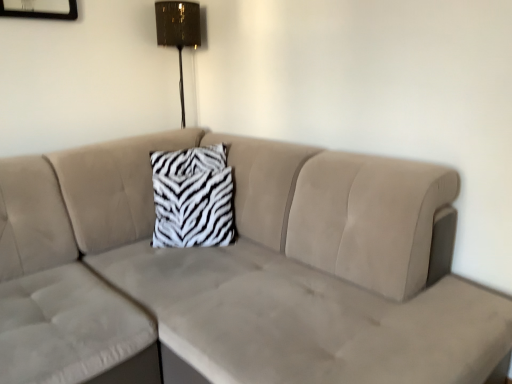
What do you see at coordinates (193, 197) in the screenshot? I see `zebra-patterned fabric pillow at center` at bounding box center [193, 197].

What do you see at coordinates (178, 32) in the screenshot? I see `metallic gold lampshade at upper center` at bounding box center [178, 32].

I want to click on zebra-patterned fabric pillow at center, so click(193, 197).

Would you say zebra-patterned fabric pillow at center is outside beige velvety couch at center?

No.

Is point (200, 170) closer or farther from the camera than point (108, 215)?

Point (200, 170) is farther from the camera than point (108, 215).

Considering the sizes of zebra-patterned fabric pillow at center and beige velvety couch at center in the image, is zebra-patterned fabric pillow at center wider or thinner than beige velvety couch at center?

zebra-patterned fabric pillow at center is thinner than beige velvety couch at center.

How many degrees apart are the facing directions of zebra-patterned fabric pillow at center and beige velvety couch at center?

49.5 degrees.

Between point (466, 376) and point (170, 222), which one is positioned in front?

The point (466, 376) is closer.

Which object is thinner, beige velvety couch at center or zebra-patterned fabric pillow at center?

zebra-patterned fabric pillow at center.

Who is taller, beige velvety couch at center or zebra-patterned fabric pillow at center?

Standing taller between the two is beige velvety couch at center.

Considering the relative sizes of beige velvety couch at center and zebra-patterned fabric pillow at center in the image provided, is beige velvety couch at center smaller than zebra-patterned fabric pillow at center?

No.

Which is more to the right, zebra-patterned fabric pillow at center or metallic gold lampshade at upper center?

From the viewer's perspective, zebra-patterned fabric pillow at center appears more on the right side.

Between point (225, 203) and point (157, 21), which one is positioned behind?

The point (157, 21) is farther.

Is zebra-patterned fabric pillow at center not close to metallic gold lampshade at upper center?

zebra-patterned fabric pillow at center is actually quite close to metallic gold lampshade at upper center.

In order to click on lamp above the zebra-patterned fabric pillow at center (from the image's perspective) in this screenshot , I will do `click(178, 32)`.

Find the location of a particular element. The height and width of the screenshot is (384, 512). lamp on the left of zebra-patterned fabric pillow at center is located at coordinates (178, 32).

From the picture: Between metallic gold lampshade at upper center and zebra-patterned fabric pillow at center, which one has less height?

Standing shorter between the two is zebra-patterned fabric pillow at center.

Is metallic gold lampshade at upper center completely or partially outside of zebra-patterned fabric pillow at center?

Indeed, metallic gold lampshade at upper center is completely outside zebra-patterned fabric pillow at center.

Between point (159, 40) and point (217, 202), which one is positioned in front?

The point (217, 202) is closer to the camera.

How different are the orientations of beige velvety couch at center and metallic gold lampshade at upper center in degrees?

90.2 degrees.

Considering the points (14, 376) and (165, 30), which point is in front, point (14, 376) or point (165, 30)?

The point (14, 376) is closer to the camera.

Would you say beige velvety couch at center is inside or outside metallic gold lampshade at upper center?

beige velvety couch at center is located beyond the bounds of metallic gold lampshade at upper center.

From the image's perspective, which one is positioned higher, beige velvety couch at center or metallic gold lampshade at upper center?

metallic gold lampshade at upper center, from the image's perspective.

Considering the positions of objects metallic gold lampshade at upper center and beige velvety couch at center in the image provided, who is behind, metallic gold lampshade at upper center or beige velvety couch at center?

metallic gold lampshade at upper center is further from the camera.

Who is shorter, metallic gold lampshade at upper center or beige velvety couch at center?

metallic gold lampshade at upper center.

Considering the positions of objects metallic gold lampshade at upper center and beige velvety couch at center in the image provided, who is more to the right, metallic gold lampshade at upper center or beige velvety couch at center?

From the viewer's perspective, beige velvety couch at center appears more on the right side.

Could you tell me if metallic gold lampshade at upper center is facing beige velvety couch at center?

No, metallic gold lampshade at upper center does not turn towards beige velvety couch at center.

Locate an element on the screen. Image resolution: width=512 pixels, height=384 pixels. pillow on the left of beige velvety couch at center is located at coordinates (193, 197).

I want to click on studio couch on the right of zebra-patterned fabric pillow at center, so [240, 270].

Considering their positions, is beige velvety couch at center positioned further to zebra-patterned fabric pillow at center than metallic gold lampshade at upper center?

metallic gold lampshade at upper center lies further to zebra-patterned fabric pillow at center than the other object.

From the picture: Which object lies nearer to the anchor point metallic gold lampshade at upper center, zebra-patterned fabric pillow at center or beige velvety couch at center?

Among the two, zebra-patterned fabric pillow at center is located nearer to metallic gold lampshade at upper center.

Which object lies further to the anchor point beige velvety couch at center, zebra-patterned fabric pillow at center or metallic gold lampshade at upper center?

→ The object further to beige velvety couch at center is metallic gold lampshade at upper center.

Based on their spatial positions, is beige velvety couch at center or zebra-patterned fabric pillow at center further from metallic gold lampshade at upper center?

Among the two, beige velvety couch at center is located further to metallic gold lampshade at upper center.

Considering their positions, is metallic gold lampshade at upper center positioned closer to beige velvety couch at center than zebra-patterned fabric pillow at center?

zebra-patterned fabric pillow at center is closer to beige velvety couch at center.

Based on their spatial positions, is metallic gold lampshade at upper center or beige velvety couch at center further from zebra-patterned fabric pillow at center?

The object further to zebra-patterned fabric pillow at center is metallic gold lampshade at upper center.

The image size is (512, 384). Identify the location of pillow between beige velvety couch at center and metallic gold lampshade at upper center along the z-axis. (193, 197).